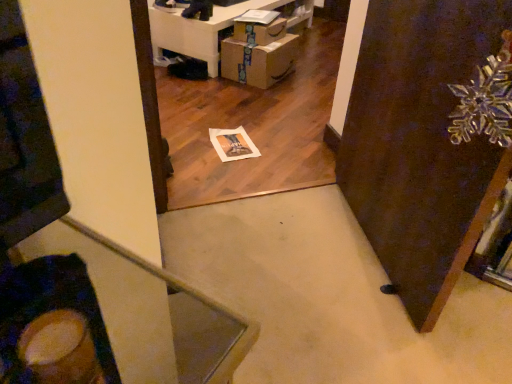
The width and height of the screenshot is (512, 384). Describe the element at coordinates (259, 32) in the screenshot. I see `brown cardboard drawer at center` at that location.

The image size is (512, 384). Identify the location of transparent glass snowflake at upper right. (420, 144).

From a real-world perspective, is transparent glass snowflake at upper right physically located above or below brown cardboard drawer at center?

From a real-world perspective, transparent glass snowflake at upper right is physically above brown cardboard drawer at center.

Measure the distance between transparent glass snowflake at upper right and brown cardboard drawer at center.

They are 5.28 feet apart.

Does point (493, 11) lie in front of point (262, 32)?

That is True.

Can you confirm if transparent glass snowflake at upper right is wider than brown cardboard drawer at center?

No, transparent glass snowflake at upper right is not wider than brown cardboard drawer at center.

How different are the orientations of cardboard boxes at lower center and transparent glass snowflake at upper right in degrees?

137 degrees separate the facing orientations of cardboard boxes at lower center and transparent glass snowflake at upper right.

From a real-world perspective, is cardboard boxes at lower center positioned over transparent glass snowflake at upper right based on gravity?

No, from a real-world perspective, cardboard boxes at lower center is not over transparent glass snowflake at upper right

Which of these two, cardboard boxes at lower center or transparent glass snowflake at upper right, is smaller?

transparent glass snowflake at upper right is smaller.

Is cardboard boxes at lower center completely or partially outside of transparent glass snowflake at upper right?

Absolutely, cardboard boxes at lower center is external to transparent glass snowflake at upper right.

In the image, there is a brown cardboard drawer at center. At what (x,y) coordinates should I click in order to perform the action: click on cardboard box below it (from the image's perspective). Please return your answer as a coordinate pair (x, y). Image resolution: width=512 pixels, height=384 pixels. Looking at the image, I should click on (258, 61).

Is brown cardboard drawer at center smaller than cardboard box at center?

Yes.

Can you tell me how much brown cardboard drawer at center and cardboard box at center differ in facing direction?

There is a 0.00113-degree angle between the facing directions of brown cardboard drawer at center and cardboard box at center.

Does brown cardboard drawer at center lie behind cardboard box at center?

Yes, brown cardboard drawer at center is further from the viewer.

From the image's perspective, is cardboard boxes at lower center above or below cardboard box at center?

cardboard boxes at lower center is situated higher than cardboard box at center in the image.

Between cardboard boxes at lower center and cardboard box at center, which one appears on the left side from the viewer's perspective?

cardboard boxes at lower center is more to the left.

Is cardboard boxes at lower center positioned in front of cardboard box at center?

That is False.

Is brown cardboard drawer at center smaller than metallic gold swivel chair at lower left?

No, brown cardboard drawer at center is not smaller than metallic gold swivel chair at lower left.

You are a GUI agent. You are given a task and a screenshot of the screen. Output one action in this format:
    pyautogui.click(x=<x>, y=<y>)
    Task: Click on the swivel chair on the left of brown cardboard drawer at center
    The height and width of the screenshot is (384, 512).
    Given the screenshot: What is the action you would take?
    pyautogui.click(x=53, y=325)

From the picture: From a real-world perspective, relative to metallic gold swivel chair at lower left, is brown cardboard drawer at center vertically above or below?

In terms of real-world spatial position, brown cardboard drawer at center is below metallic gold swivel chair at lower left.

From a real-world perspective, is metallic gold swivel chair at lower left beneath cardboard box at center?

No, from a real-world perspective, metallic gold swivel chair at lower left is not under cardboard box at center.

Is metallic gold swivel chair at lower left situated inside cardboard box at center or outside?

metallic gold swivel chair at lower left lies outside cardboard box at center.

Between metallic gold swivel chair at lower left and cardboard box at center, which one has larger width?

With larger width is cardboard box at center.

Is metallic gold swivel chair at lower left shorter than cardboard box at center?

Yes.

Find the location of a particular element. swivel chair that is below the cardboard boxes at lower center (from the image's perspective) is located at coordinates 53,325.

Is cardboard boxes at lower center far away from metallic gold swivel chair at lower left?

That's right, there is a large distance between cardboard boxes at lower center and metallic gold swivel chair at lower left.

Between point (209, 51) and point (51, 381), which one is positioned behind?

The point (209, 51) is farther.

This screenshot has height=384, width=512. In the image, there is a brown cardboard drawer at center. Find the location of `door below it (from the image's perspective)`. door below it (from the image's perspective) is located at coordinates (420, 144).

The width and height of the screenshot is (512, 384). In order to click on door lying on the right of cardboard boxes at lower center in this screenshot , I will do `click(420, 144)`.

From the image, which object appears to be farther from cardboard boxes at lower center, metallic gold swivel chair at lower left or cardboard box at center?

The object further to cardboard boxes at lower center is metallic gold swivel chair at lower left.

Considering their positions, is cardboard box at center positioned further to cardboard boxes at lower center than transparent glass snowflake at upper right?

Among the two, transparent glass snowflake at upper right is located further to cardboard boxes at lower center.

Looking at the image, which one is located closer to transparent glass snowflake at upper right, cardboard boxes at lower center or metallic gold swivel chair at lower left?

metallic gold swivel chair at lower left.

Considering their positions, is brown cardboard drawer at center positioned further to metallic gold swivel chair at lower left than cardboard box at center?

brown cardboard drawer at center is positioned further to the anchor metallic gold swivel chair at lower left.

From the image, which object appears to be nearer to transparent glass snowflake at upper right, cardboard boxes at lower center or cardboard box at center?

Among the two, cardboard box at center is located nearer to transparent glass snowflake at upper right.

When comparing their distances from cardboard boxes at lower center, does transparent glass snowflake at upper right or cardboard box at center seem closer?

The object closer to cardboard boxes at lower center is cardboard box at center.

From the image, which object appears to be nearer to brown cardboard drawer at center, metallic gold swivel chair at lower left or transparent glass snowflake at upper right?

Among the two, transparent glass snowflake at upper right is located nearer to brown cardboard drawer at center.

Which object lies further to the anchor point brown cardboard drawer at center, metallic gold swivel chair at lower left or cardboard boxes at lower center?

metallic gold swivel chair at lower left is further to brown cardboard drawer at center.

Where is `cardboard box between metallic gold swivel chair at lower left and cardboard boxes at lower center from front to back`? This screenshot has width=512, height=384. cardboard box between metallic gold swivel chair at lower left and cardboard boxes at lower center from front to back is located at coordinates (258, 61).

At what (x,y) coordinates should I click in order to perform the action: click on cardboard box between transparent glass snowflake at upper right and brown cardboard drawer at center along the z-axis. Please return your answer as a coordinate pair (x, y). Image resolution: width=512 pixels, height=384 pixels. Looking at the image, I should click on (258, 61).

Find the location of a particular element. The height and width of the screenshot is (384, 512). cardboard box between metallic gold swivel chair at lower left and brown cardboard drawer at center in the front-back direction is located at coordinates 258,61.

Find the location of a particular element. door between metallic gold swivel chair at lower left and cardboard box at center from front to back is located at coordinates (420, 144).